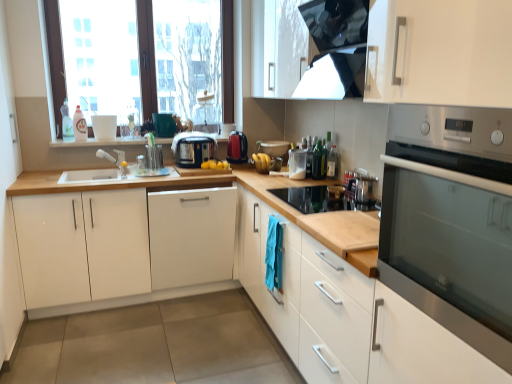
Question: Does point (311, 173) appear closer or farther from the camera than point (82, 127)?

Choices:
 (A) closer
 (B) farther

Answer: (A)

Question: From a real-world perspective, is green glass bottle at center, which appears as the 2th bottle when viewed from the front, above or below translucent plastic bottle at upper left, which is the third bottle from front to back?

Choices:
 (A) above
 (B) below

Answer: (B)

Question: Which object is the closest to the translucent plastic bottle at upper left, positioned as the first bottle in back-to-front order?

Choices:
 (A) wooden cutting board at center
 (B) black plastic toaster at center, positioned as the 1th kitchen appliance in left-to-right order
 (C) clear plastic container at center, the second appliance viewed from the top
 (D) green glass bottle at center, which appears as the 2th bottle when viewed from the front
 (E) white matte cabinet at right, which is counted as the third cabinetry, starting from the left

Answer: (A)

Question: Estimate the real-world distances between objects in this image. Which object is farther from the transparent glass window at upper left?

Choices:
 (A) clear plastic container at center, which is counted as the second appliance, starting from the front
 (B) white matte cabinet at center, which ranks as the 2th cabinetry in right-to-left order
 (C) white matte cabinet at right, which is counted as the third cabinetry, starting from the left
 (D) translucent plastic bottle at upper left, which is the third bottle in right-to-left order
 (E) black plastic toaster at center, positioned as the 1th kitchen appliance in left-to-right order

Answer: (C)